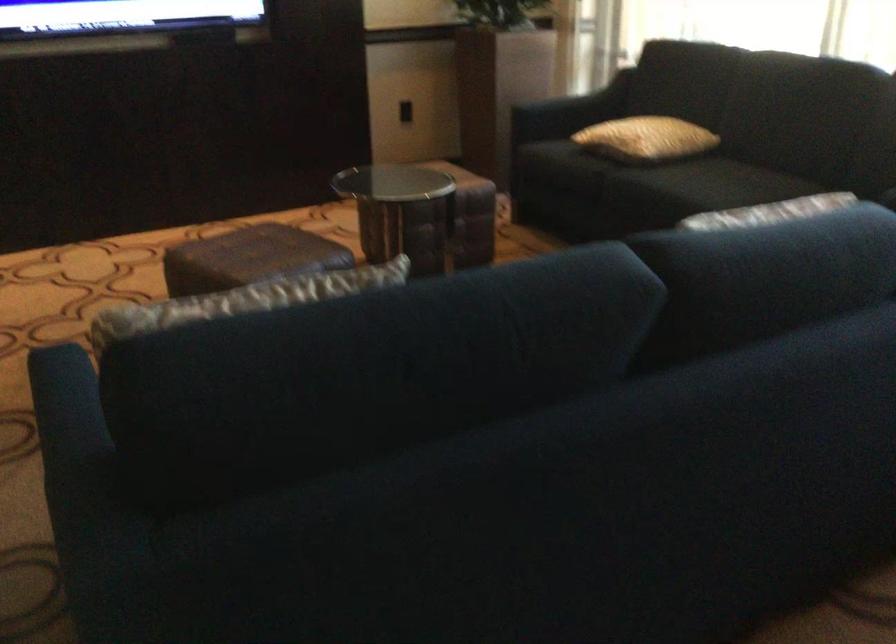
The height and width of the screenshot is (644, 896). What do you see at coordinates (69, 431) in the screenshot? I see `the sofa armrest` at bounding box center [69, 431].